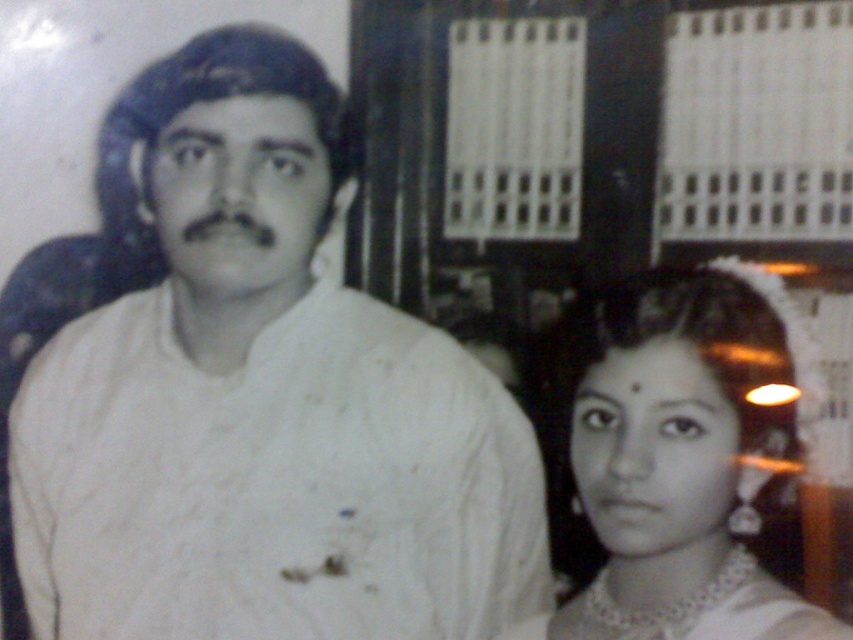
Question: Can you confirm if white textured shirt at center is bigger than pearl necklace at center?

Choices:
 (A) no
 (B) yes

Answer: (B)

Question: Which point appears farthest from the camera in this image?

Choices:
 (A) (320, 291)
 (B) (657, 276)

Answer: (A)

Question: Is white textured shirt at center further to camera compared to pearl necklace at center?

Choices:
 (A) no
 (B) yes

Answer: (B)

Question: Is white textured shirt at center smaller than pearl necklace at center?

Choices:
 (A) yes
 (B) no

Answer: (B)